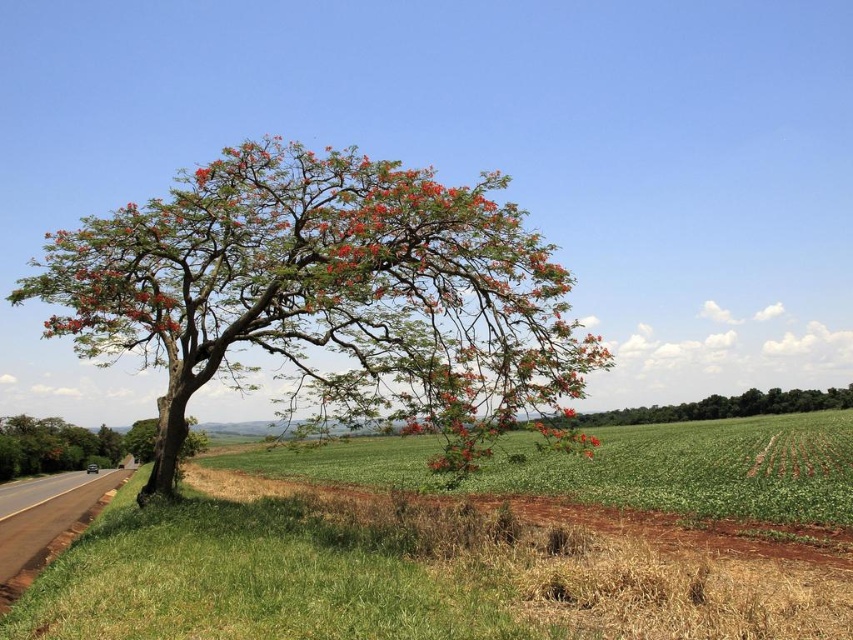
Between green grassy field at lower center and asphalt road at lower left, which one has less height?

asphalt road at lower left is shorter.

Can you confirm if green grassy field at lower center is shorter than asphalt road at lower left?

No, green grassy field at lower center is not shorter than asphalt road at lower left.

Image resolution: width=853 pixels, height=640 pixels. Describe the element at coordinates (397, 566) in the screenshot. I see `green grassy field at lower center` at that location.

This screenshot has width=853, height=640. In order to click on green grassy field at lower center in this screenshot , I will do `click(397, 566)`.

Locate an element on the screen. green grassy field at lower center is located at coordinates (397, 566).

Which is in front, point (604, 538) or point (25, 444)?

Positioned in front is point (604, 538).

Who is more forward, [462,563] or [74,458]?

Point [462,563] is more forward.

Find the location of a particular element. The width and height of the screenshot is (853, 640). green grassy field at lower center is located at coordinates (397, 566).

Can you confirm if green leafy tree at left is bigger than asphalt road at lower left?

Correct, green leafy tree at left is larger in size than asphalt road at lower left.

Does point (146, 422) come farther from viewer compared to point (91, 500)?

Yes, it is.

Locate an element on the screen. The width and height of the screenshot is (853, 640). green leafy tree at left is located at coordinates 67,444.